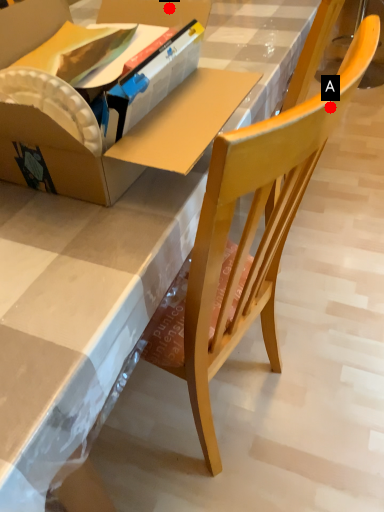
Question: Two points are circled on the image, labeled by A and B beside each circle. Which point is closer to the camera?

Choices:
 (A) A is closer
 (B) B is closer

Answer: (A)